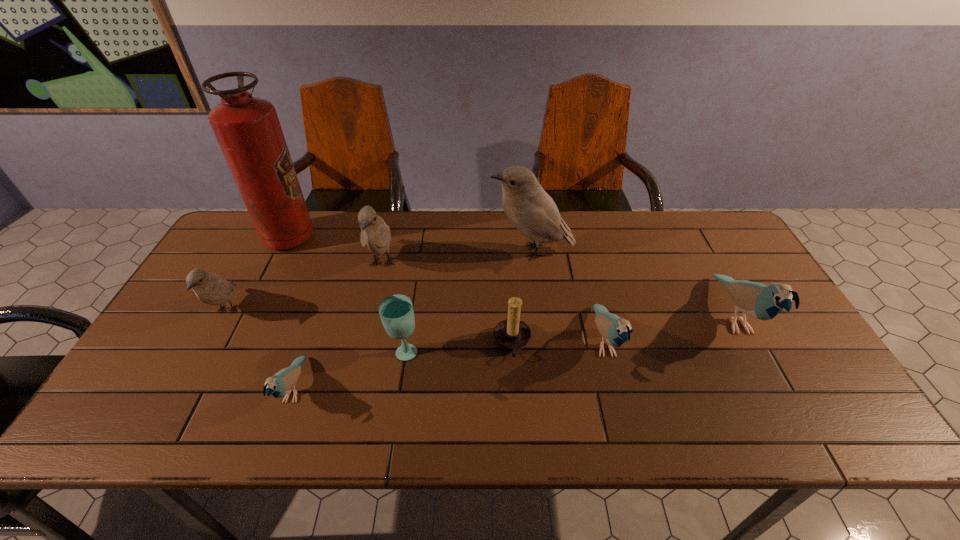
The image size is (960, 540). In order to click on vacant area between the tallest object and the second tallest object in this screenshot , I will do `click(410, 244)`.

Where is `empty location between the candle holder and the red fire extinguisher`? empty location between the candle holder and the red fire extinguisher is located at coordinates (400, 291).

Find the location of a particular element. The height and width of the screenshot is (540, 960). free spot between the rightmost object and the leftmost white bird is located at coordinates (480, 314).

Image resolution: width=960 pixels, height=540 pixels. Identify the location of unoccupied area between the brown candle holder and the second biggest blue bird. click(558, 343).

Locate an element on the screen. Image resolution: width=960 pixels, height=540 pixels. unoccupied area between the fire extinguisher and the shortest bird is located at coordinates (292, 314).

The width and height of the screenshot is (960, 540). I want to click on vacant region between the second tallest object and the second blue bird from right to left, so click(567, 296).

The height and width of the screenshot is (540, 960). I want to click on free point between the glass and the tallest object, so click(x=347, y=294).

Locate an element on the screen. free spot between the fourth bird from right to left and the second smallest blue bird is located at coordinates tap(493, 303).

In order to click on object that is the fourth closest to the glass in this screenshot , I will do (532, 211).

Where is `object that is the eighth closest to the second white bird from right to left`? Image resolution: width=960 pixels, height=540 pixels. object that is the eighth closest to the second white bird from right to left is located at coordinates (756, 300).